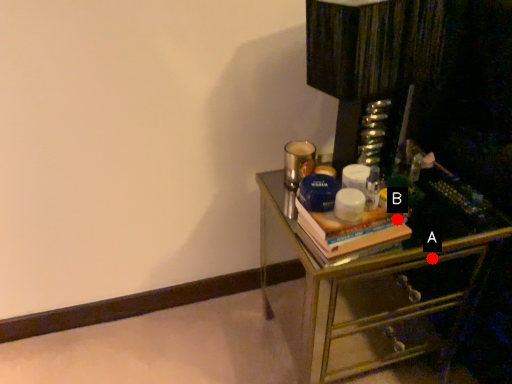
Question: Two points are circled on the image, labeled by A and B beside each circle. Which point is farther from the camera taking this photo?

Choices:
 (A) A is further
 (B) B is further

Answer: (A)